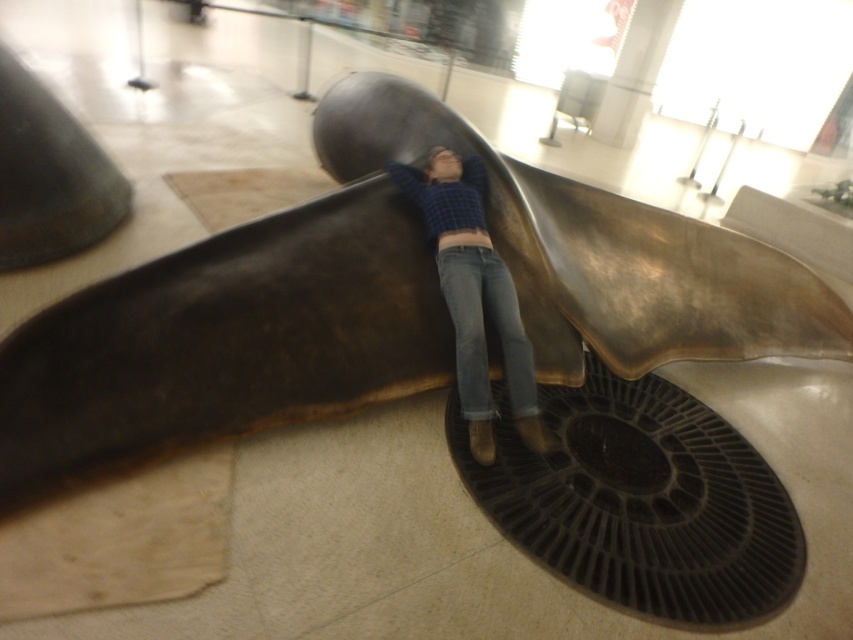
You are a fitness trainer designing an exercise routine. You want to ensure that the participant can reach a target placed on the shiny bronze sculpture at center while standing on the denim jeans at center. If the participant can extend their arm 50 centimeters, will they be able to reach the target?

The distance between the shiny bronze sculpture at center and denim jeans at center is 51.91 centimeters. Since the participant can only extend their arm 50 centimeters, they will not be able to reach the target placed on the shiny bronze sculpture at center from the denim jeans at center.

You are a photographer trying to capture a closeup of the person in the scene. You need to focus on either the blue plaid shirt at center or the denim jeans at center. Which one should you focus on first if you want to ensure the taller object is in focus?

The blue plaid shirt at center is much taller than the denim jeans at center, so you should focus on the blue plaid shirt at center first to ensure the taller object is in focus.

You are standing in front of the sculpture and want to place a small sticker on the sculpture. You have two options for placement based on coordinates given in the scene. The first option is at point (633, 332) and the second option is at point (438, 211). Which point is closer to you if you are facing the sculpture directly?

Point (438, 211) is closer to you because it is in front of point (633, 332) when facing the sculpture directly.